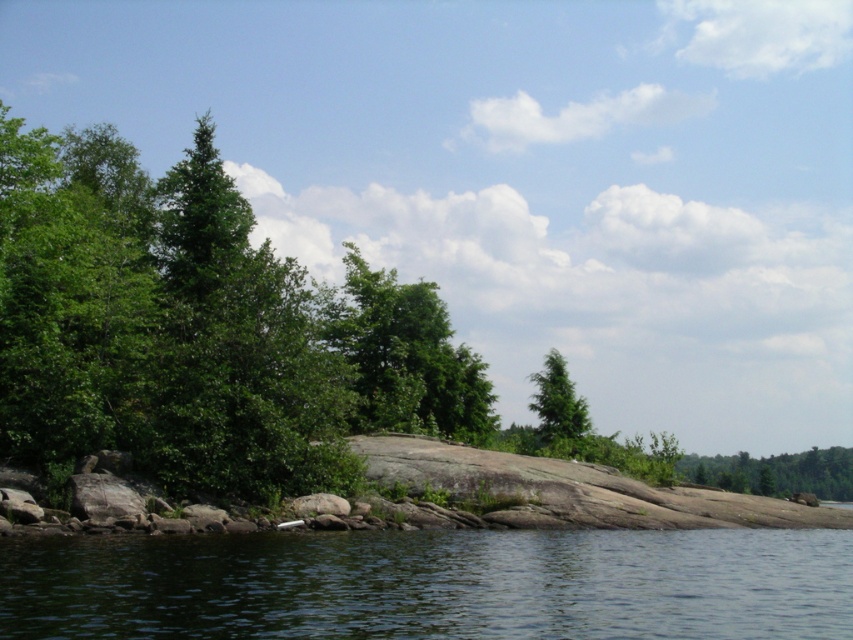
Question: Does green leafy tree at center have a larger size compared to green matte tree at lower right?

Choices:
 (A) yes
 (B) no

Answer: (B)

Question: Which point is closer to the camera?

Choices:
 (A) green matte tree at lower right
 (B) transparent water at lower left
 (C) green leafy tree at center

Answer: (B)

Question: Estimate the real-world distances between objects in this image. Which object is farther from the transparent water at lower left?

Choices:
 (A) green leafy tree at center
 (B) green matte tree at upper center
 (C) green matte tree at lower right

Answer: (C)

Question: Is green matte tree at lower right positioned behind green matte tree at upper center?

Choices:
 (A) no
 (B) yes

Answer: (B)

Question: Among these objects, which one is farthest from the camera?

Choices:
 (A) green matte tree at lower right
 (B) transparent water at lower left
 (C) green leafy tree at center

Answer: (A)

Question: Can you confirm if green leafy tree at center is bigger than green matte tree at lower right?

Choices:
 (A) no
 (B) yes

Answer: (A)